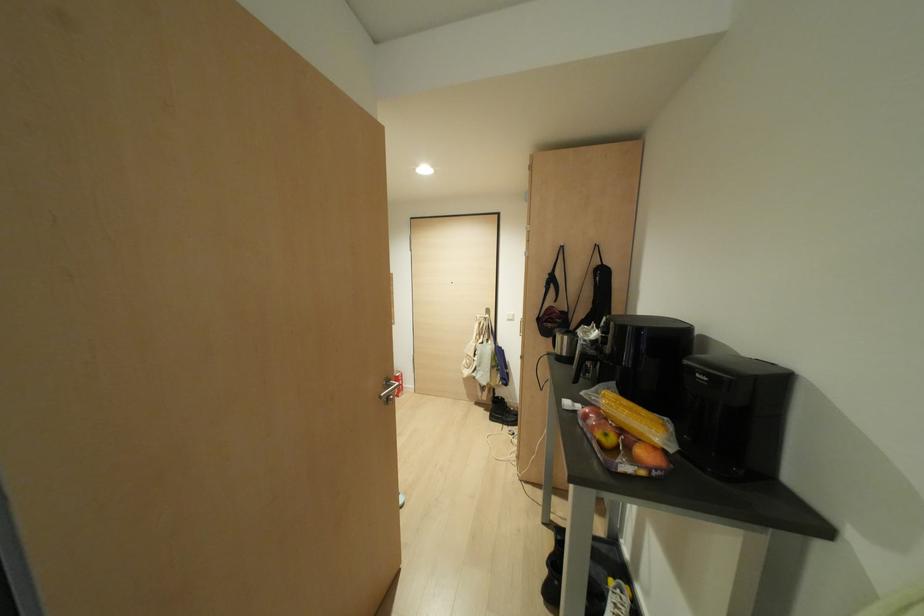
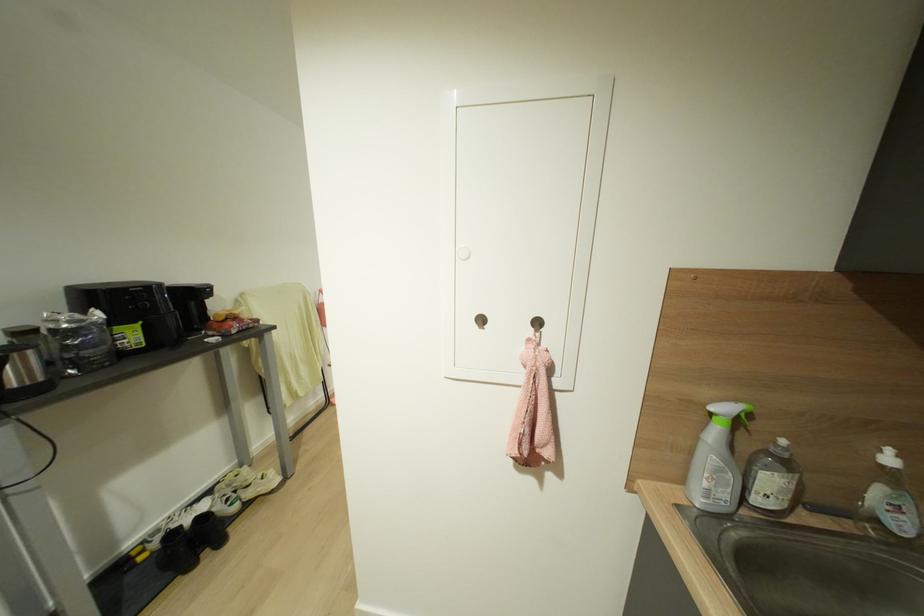
Question: I am providing you with two images of the same scene from different viewpoints. Please identify which objects are invisible in image2.

Choices:
 (A) white sneaker
 (B) tissue box
 (C) black boot
 (D) white bottle pump

Answer: (C)